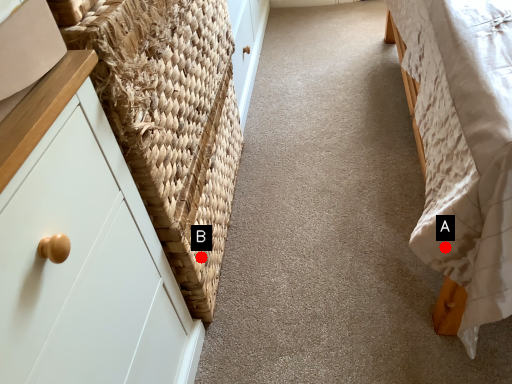
Question: Two points are circled on the image, labeled by A and B beside each circle. Which point is closer to the camera?

Choices:
 (A) A is closer
 (B) B is closer

Answer: (A)